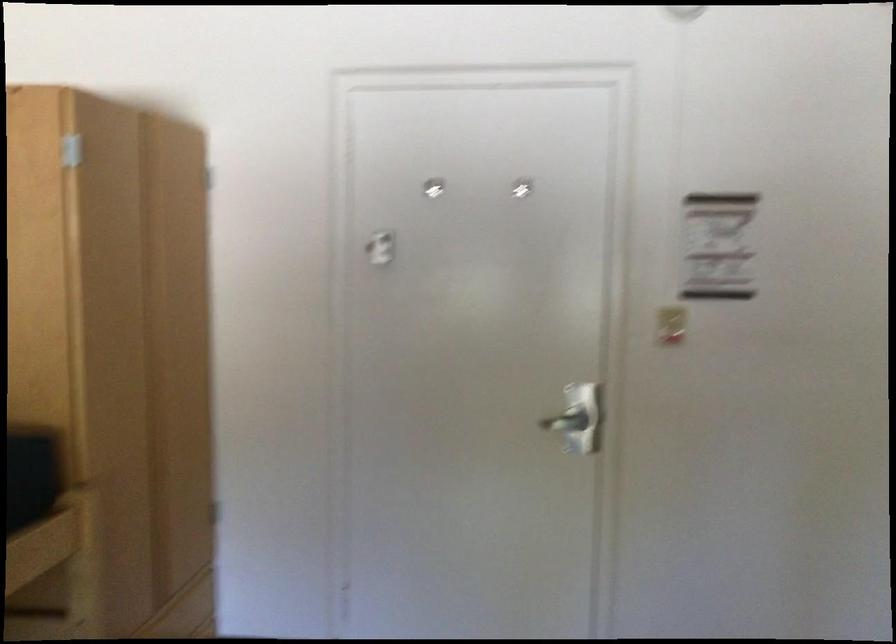
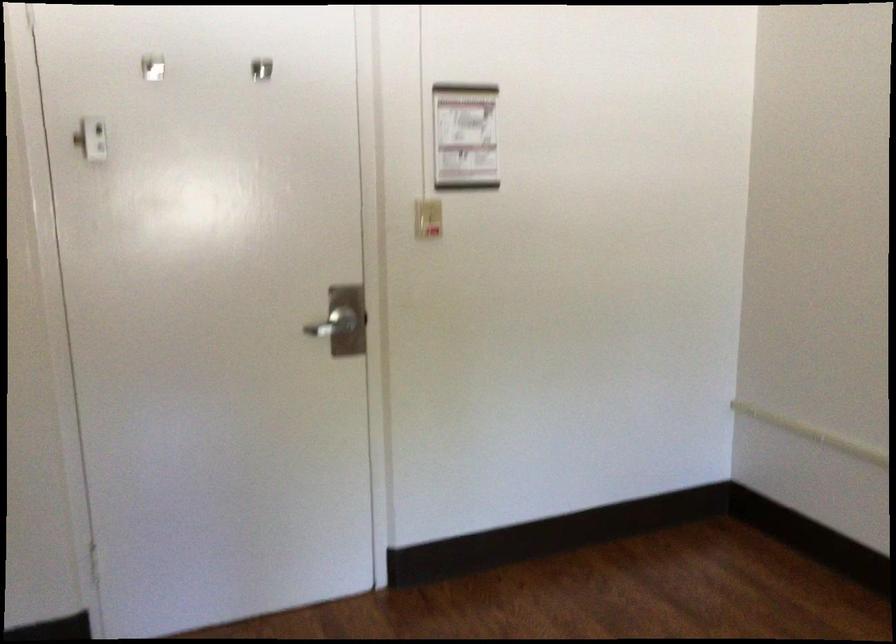
In the second image, find the point that corresponds to point (668, 328) in the first image.

(427, 218)